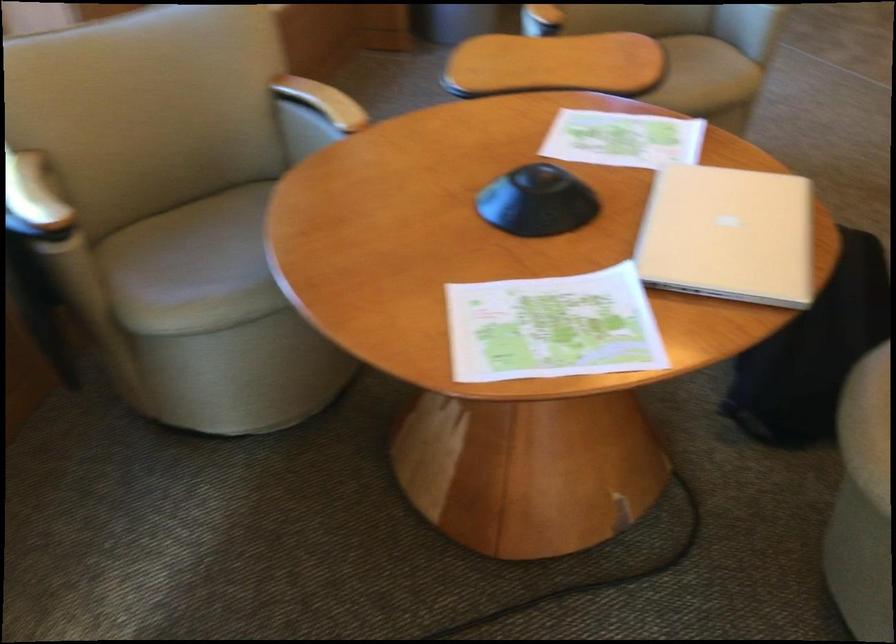
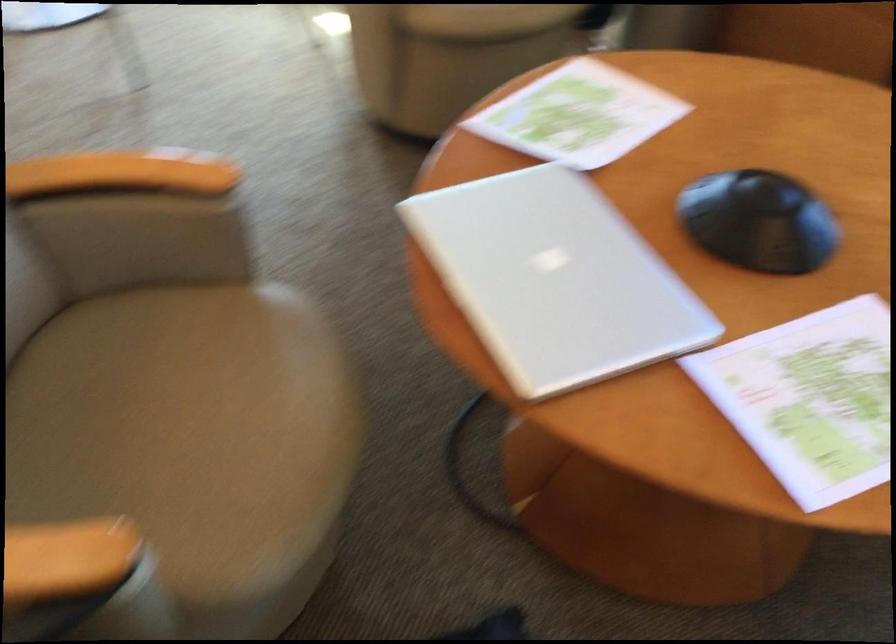
Locate, in the second image, the point that corresponds to point (556, 156) in the first image.

(810, 399)